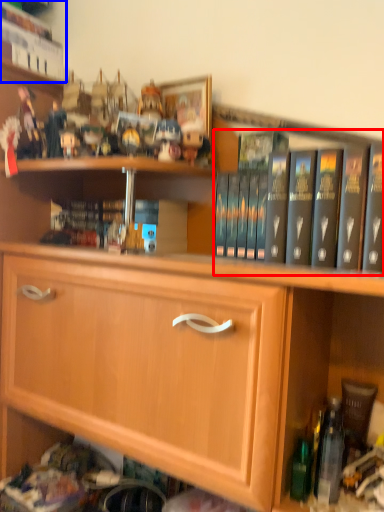
Question: Which of the following is the closest to the observer, book (highlighted by a red box) or book (highlighted by a blue box)?

Choices:
 (A) book
 (B) book

Answer: (A)